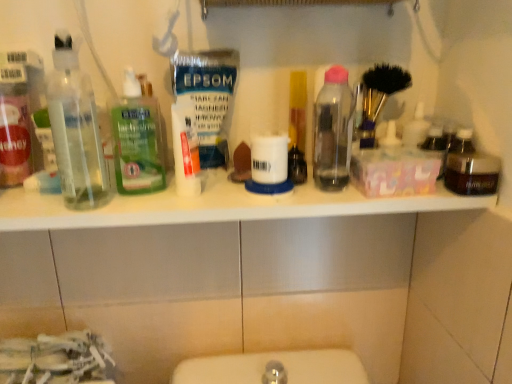
Where is `vacant space to the right of white matte tube at center`? Image resolution: width=512 pixels, height=384 pixels. vacant space to the right of white matte tube at center is located at coordinates (261, 208).